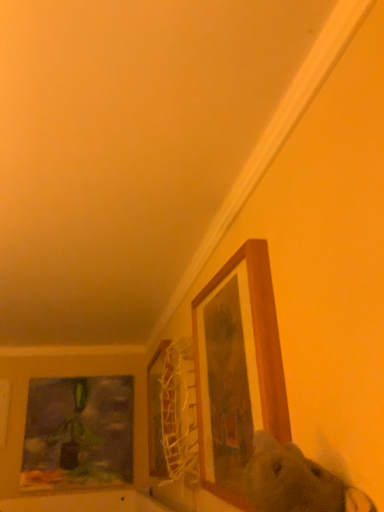
Question: Considering the positions of wooden frame at upper right, which is counted as the first picture frame, starting from the front, and matte glass painting at left, which is counted as the 3th picture frame, starting from the right, in the image, is wooden frame at upper right, which is counted as the first picture frame, starting from the front, bigger or smaller than matte glass painting at left, which is counted as the 3th picture frame, starting from the right,?

Choices:
 (A) big
 (B) small

Answer: (A)

Question: From a real-world perspective, is wooden frame at upper right, the 4th picture frame viewed from the back, physically located above or below matte glass painting at left, which is the fourth picture frame from front to back?

Choices:
 (A) below
 (B) above

Answer: (B)

Question: Estimate the real-world distances between objects in this image. Which object is farther from the matte glass painting at left, which is the fourth picture frame from front to back?

Choices:
 (A) wooden frame at upper right, which is counted as the first picture frame, starting from the front
 (B) fluffy white dog at center
 (C) wooden picture frame at lower left, the second picture frame when ordered from back to front
 (D) wooden picture frame at center, the 2th picture frame viewed from the front

Answer: (B)

Question: Which of these objects is positioned farthest from the wooden picture frame at center, which ranks as the third picture frame in left-to-right order?

Choices:
 (A) wooden frame at upper right, the 4th picture frame viewed from the back
 (B) fluffy white dog at center
 (C) matte glass painting at left, which is the fourth picture frame from front to back
 (D) wooden picture frame at lower left, the first picture frame when ordered from left to right

Answer: (B)